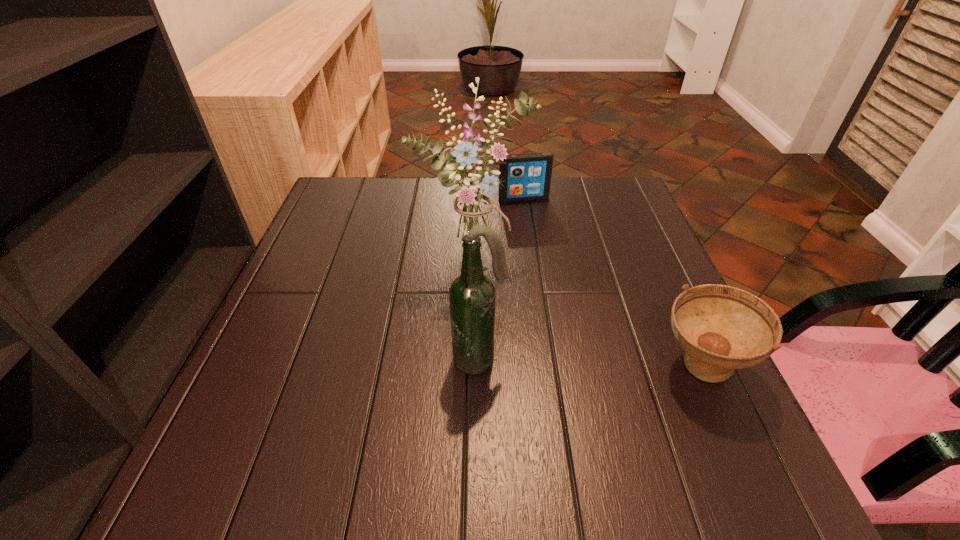
Locate an element on the screen. The height and width of the screenshot is (540, 960). beer bottle is located at coordinates (472, 296).

In order to click on the rightmost object in this screenshot , I will do `click(721, 328)`.

You are a GUI agent. You are given a task and a screenshot of the screen. Output one action in this format:
    pyautogui.click(x=<x>, y=<y>)
    Task: Click on the farthest object
    
    Given the screenshot: What is the action you would take?
    pyautogui.click(x=527, y=176)

At what (x,y) coordinates should I click in order to perform the action: click on bouquet. Please return your answer as a coordinate pair (x, y). This screenshot has height=540, width=960. Looking at the image, I should click on (472, 205).

Image resolution: width=960 pixels, height=540 pixels. Find the location of `the tallest object`. the tallest object is located at coordinates point(472,205).

Where is `free region located on the left of the third shortest object`? The width and height of the screenshot is (960, 540). free region located on the left of the third shortest object is located at coordinates (271, 360).

Locate an element on the screen. vacant space situated 0.260m on the back of the soup bowl is located at coordinates (648, 252).

This screenshot has height=540, width=960. I want to click on vacant space located 0.340m on the front screen of the farthest object, so click(559, 283).

Image resolution: width=960 pixels, height=540 pixels. Find the location of `free location located on the front screen of the farthest object`. free location located on the front screen of the farthest object is located at coordinates (534, 219).

Find the location of a particular element. free space located 0.280m on the front screen of the farthest object is located at coordinates (552, 266).